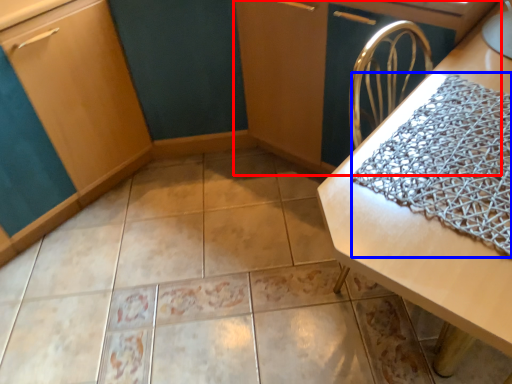
Question: Which point is further to the camera, dresser (highlighted by a red box) or blanket (highlighted by a blue box)?

Choices:
 (A) dresser
 (B) blanket

Answer: (A)